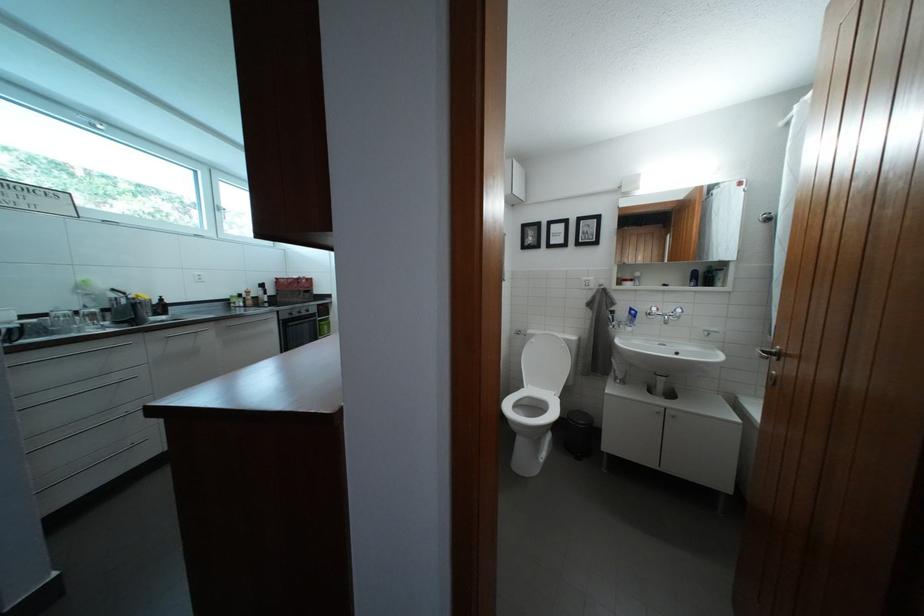
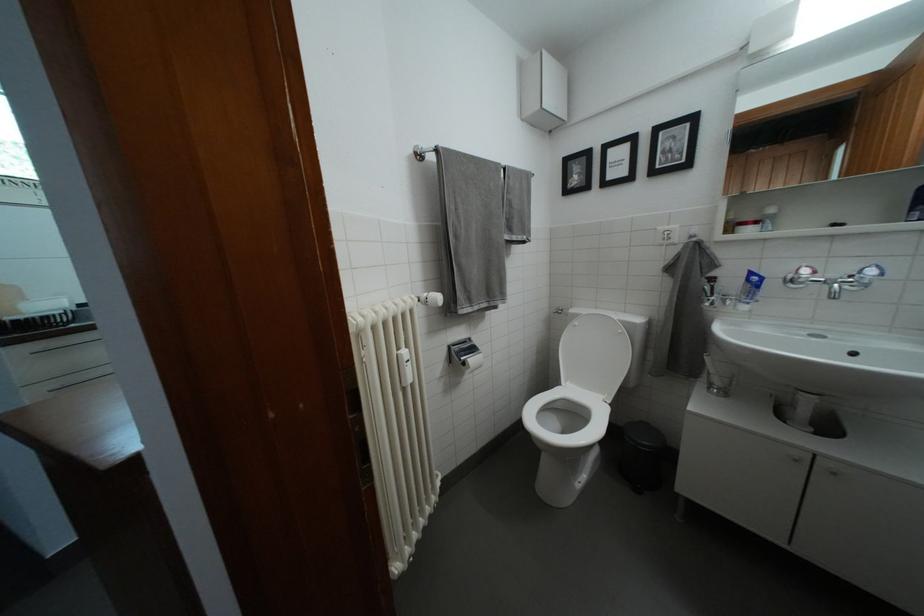
Question: I am providing you with two images of the same scene from different viewpoints. Which of the following objects are not visible in image2?

Choices:
 (A) radiator thermostat knob
 (B) silver faucet handle
 (C) clear drinking glass
 (D) none of these

Answer: (D)